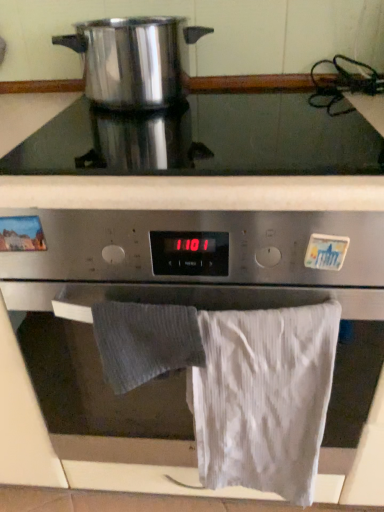
Question: Would you say stainless steel oven at center is inside or outside polished stainless steel pot at upper left?

Choices:
 (A) outside
 (B) inside

Answer: (A)

Question: From a real-world perspective, is stainless steel oven at center above or below polished stainless steel pot at upper left?

Choices:
 (A) above
 (B) below

Answer: (B)

Question: Estimate the real-world distances between objects in this image. Which object is farther from the white cotton towel at lower right, arranged as the first bath towel when viewed from the right?

Choices:
 (A) gray textured towel at lower center, acting as the second bath towel starting from the right
 (B) satin silver cooktop at upper center
 (C) stainless steel oven at center
 (D) polished stainless steel pot at upper left

Answer: (D)

Question: Considering the real-world distances, which object is closest to the stainless steel oven at center?

Choices:
 (A) polished stainless steel pot at upper left
 (B) satin silver cooktop at upper center
 (C) white cotton towel at lower right, arranged as the first bath towel when viewed from the right
 (D) gray textured towel at lower center, the 1th bath towel in the left-to-right sequence

Answer: (C)